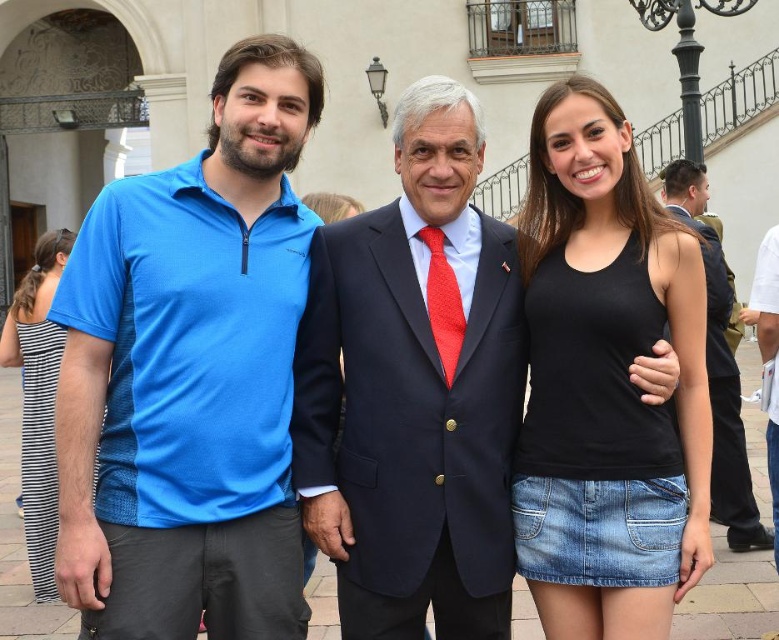
You are a photographer trying to adjust the lighting for a group photo. The blue fabric shirt at center and navy blue suit at center are in the frame. Which clothing item requires more light adjustment due to its size?

The blue fabric shirt at center has a larger size compared to the navy blue suit at center, so it requires more light adjustment due to its size.

You are a photographer trying to capture a clear shot of the navy blue suit at center and the red textured tie at center. Since you want to focus on both, which object should you adjust your camera focus on first to ensure both are in frame?

The navy blue suit at center is much taller than the red textured tie at center, so you should focus on the navy blue suit at center first to ensure both are in frame.